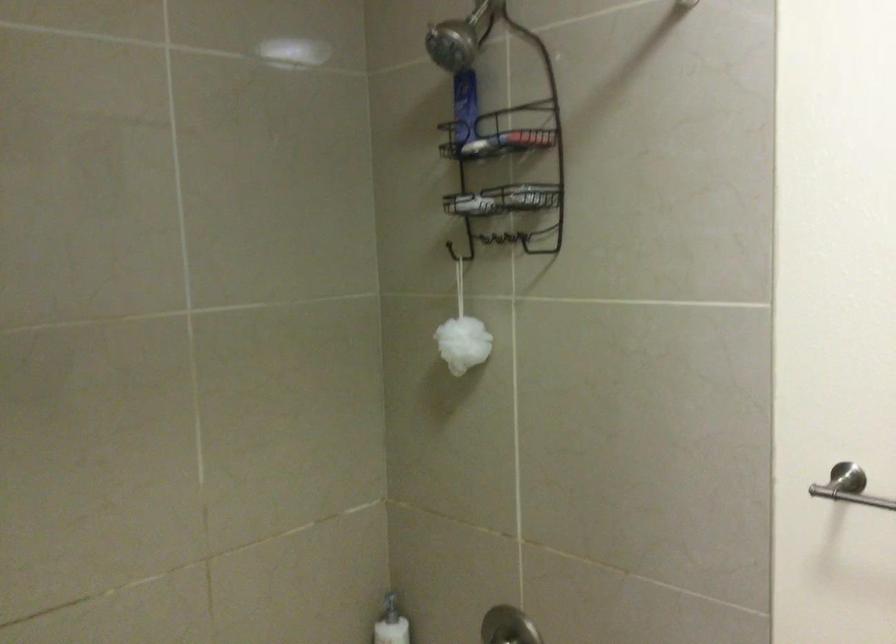
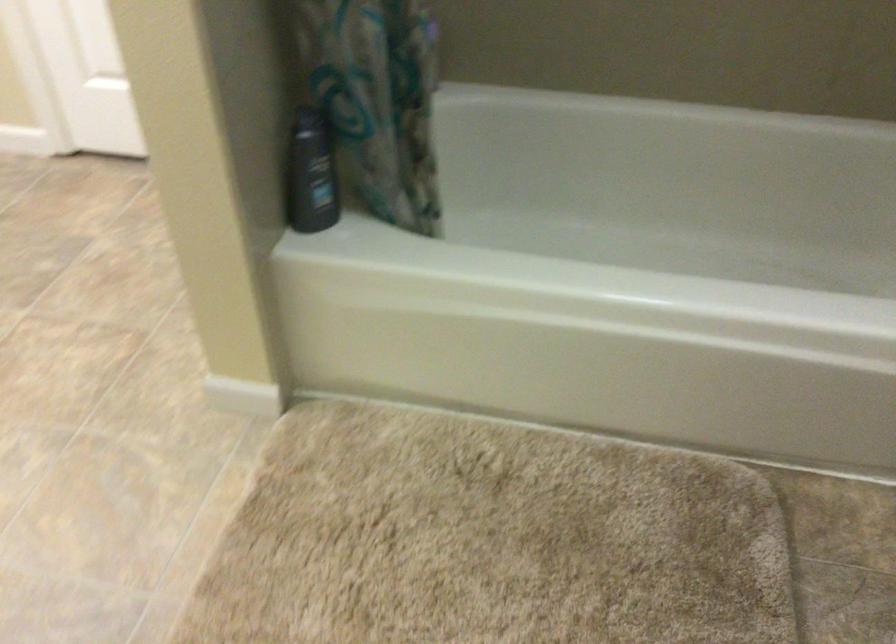
First-person continuous shooting, in which direction is the camera rotating?

The camera's rotation is toward left-down.